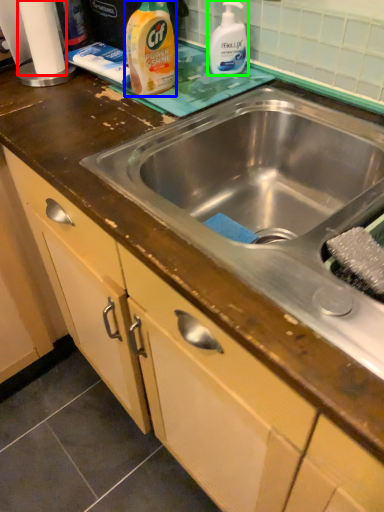
Question: Which object is the farthest from toilet paper (highlighted by a red box)? Choose among these: cleaning product (highlighted by a blue box) or cleaning product (highlighted by a green box).

Choices:
 (A) cleaning product
 (B) cleaning product

Answer: (B)